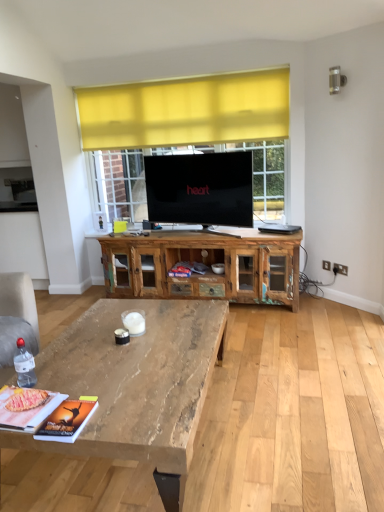
Question: Considering the positions of natural wood coffee table at lower left and rustic wood cabinet at center in the image, is natural wood coffee table at lower left bigger or smaller than rustic wood cabinet at center?

Choices:
 (A) small
 (B) big

Answer: (B)

Question: Considering the positions of natural wood coffee table at lower left and rustic wood cabinet at center in the image, is natural wood coffee table at lower left taller or shorter than rustic wood cabinet at center?

Choices:
 (A) short
 (B) tall

Answer: (A)

Question: Is natural wood coffee table at lower left to the left or to the right of rustic wood cabinet at center in the image?

Choices:
 (A) left
 (B) right

Answer: (A)

Question: Considering the positions of rustic wood cabinet at center and natural wood coffee table at lower left in the image, is rustic wood cabinet at center bigger or smaller than natural wood coffee table at lower left?

Choices:
 (A) big
 (B) small

Answer: (B)

Question: From a real-world perspective, is rustic wood cabinet at center positioned above or below natural wood coffee table at lower left?

Choices:
 (A) above
 (B) below

Answer: (A)

Question: Looking at their shapes, would you say rustic wood cabinet at center is wider or thinner than natural wood coffee table at lower left?

Choices:
 (A) wide
 (B) thin

Answer: (B)

Question: From the image's perspective, relative to natural wood coffee table at lower left, is rustic wood cabinet at center above or below?

Choices:
 (A) below
 (B) above

Answer: (B)